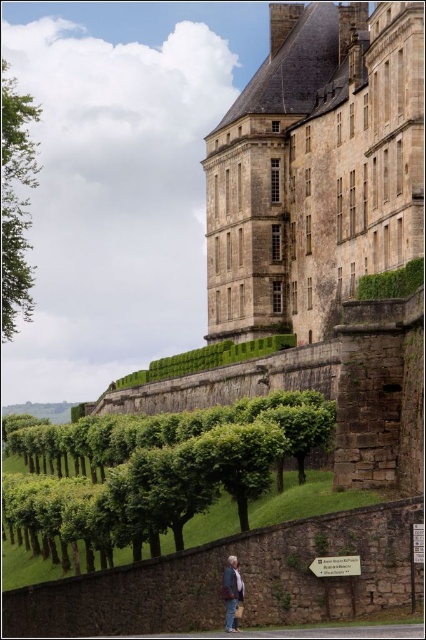
You are standing at the entrance of the grand stone building and want to walk to the green leafy hedge at center. According to the coordinates provided, in which direction should you move relative to the building?

The green leafy hedge at center is located at coordinates point (391, 282). Since the coordinates are relative to the image, moving towards the lower right direction from the building would lead you to the hedge.

You are standing in front of the historic stone building and want to know if the green leafy tree at left is wider than the brown leather jacket at lower center. Can you determine this based on the scene?

The green leafy tree at left is wider than the brown leather jacket at lower center because its width surpasses that of the jacket.